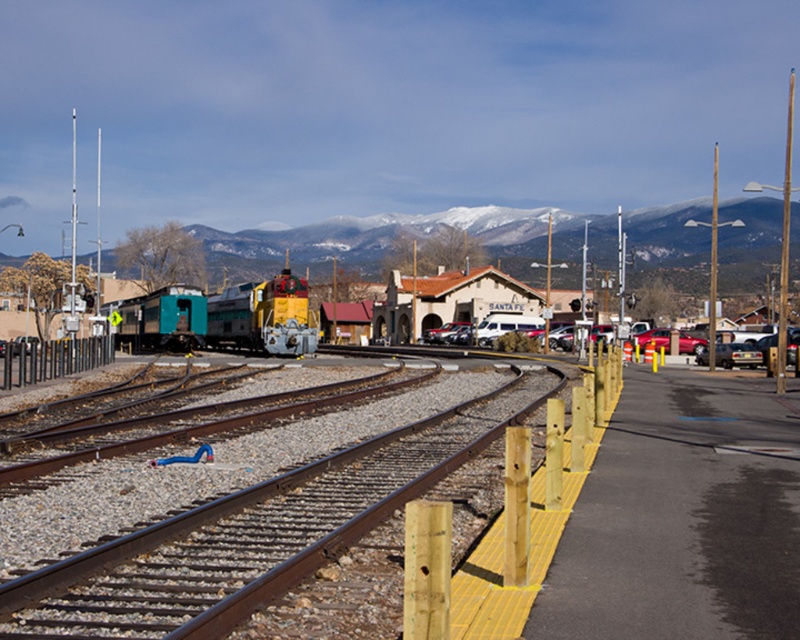
Question: Can you confirm if brown stucco railway station at center is thinner than metallic red car at center-right?

Choices:
 (A) yes
 (B) no

Answer: (B)

Question: Does snowy mountain at upper center appear under metallic silver car at center?

Choices:
 (A) yes
 (B) no

Answer: (B)

Question: Which of the following is the farthest from the observer?

Choices:
 (A) metallic silver sedan at right
 (B) metallic silver car at center

Answer: (B)

Question: Estimate the real-world distances between objects in this image. Which object is closer to the metallic silver car at center?

Choices:
 (A) metallic silver sedan at right
 (B) metallic red car at center-right

Answer: (B)

Question: Which point is farther from the camera taking this photo?

Choices:
 (A) (664, 337)
 (B) (425, 340)
 (C) (120, 608)
 (D) (136, 298)

Answer: (B)

Question: Does rusty metal train track at center have a larger size compared to metallic silver car at center?

Choices:
 (A) no
 (B) yes

Answer: (A)